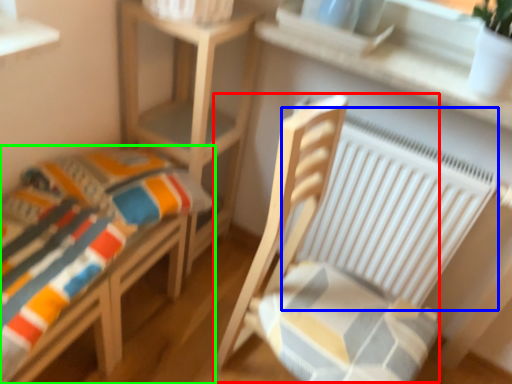
Question: Considering the real-world distances, which object is closest to rocking chair (highlighted by a red box)? radiator (highlighted by a blue box) or furniture (highlighted by a green box).

Choices:
 (A) radiator
 (B) furniture

Answer: (A)